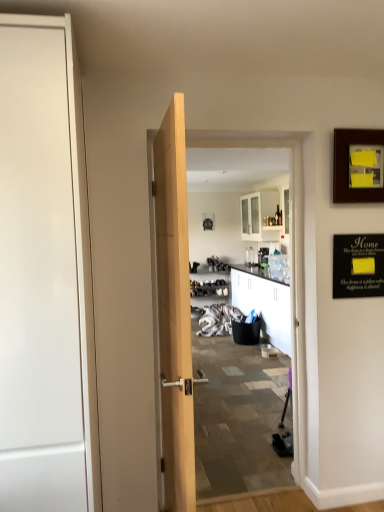
Question: From the image's perspective, would you say black matte bulletin board at upper right is shown under wooden picture frame at center, placed as the 1th picture frame when sorted from left to right?

Choices:
 (A) no
 (B) yes

Answer: (B)

Question: Is black matte bulletin board at upper right at the right side of wooden picture frame at center, acting as the 2th picture frame starting from the right?

Choices:
 (A) yes
 (B) no

Answer: (A)

Question: Can you confirm if black matte bulletin board at upper right is shorter than wooden picture frame at center, acting as the 2th picture frame starting from the right?

Choices:
 (A) yes
 (B) no

Answer: (B)

Question: Is black matte bulletin board at upper right wider than wooden picture frame at center, the 2th picture frame from the front?

Choices:
 (A) no
 (B) yes

Answer: (A)

Question: From the image's perspective, is black matte bulletin board at upper right on top of wooden picture frame at center, the 2th picture frame from the front?

Choices:
 (A) yes
 (B) no

Answer: (B)

Question: From a real-world perspective, is black matte bulletin board at upper right physically below wooden picture frame at center, placed as the 1th picture frame when sorted from left to right?

Choices:
 (A) no
 (B) yes

Answer: (B)

Question: Is wooden picture frame at upper right, placed as the 1th picture frame when sorted from right to left, closer to camera compared to wooden picture frame at center, the 2th picture frame from the front?

Choices:
 (A) no
 (B) yes

Answer: (B)

Question: Could you tell me if wooden picture frame at upper right, placed as the 1th picture frame when sorted from right to left, is facing wooden picture frame at center, acting as the 2th picture frame starting from the right?

Choices:
 (A) no
 (B) yes

Answer: (A)

Question: Is wooden picture frame at upper right, placed as the 1th picture frame when sorted from right to left, at the right side of wooden picture frame at center, placed as the 1th picture frame when sorted from left to right?

Choices:
 (A) no
 (B) yes

Answer: (B)

Question: Is wooden picture frame at upper right, the second picture frame positioned from the left, oriented away from wooden picture frame at center, acting as the 2th picture frame starting from the right?

Choices:
 (A) yes
 (B) no

Answer: (A)

Question: Is wooden picture frame at upper right, the second picture frame when ordered from back to front, at the left side of wooden picture frame at center, placed as the 1th picture frame when sorted from left to right?

Choices:
 (A) yes
 (B) no

Answer: (B)

Question: Can you confirm if wooden picture frame at upper right, placed as the 1th picture frame when sorted from right to left, is thinner than wooden picture frame at center, placed as the 1th picture frame when sorted from left to right?

Choices:
 (A) no
 (B) yes

Answer: (B)

Question: Is wooden picture frame at center, placed as the 1th picture frame when sorted from left to right, bigger than white glossy door at left?

Choices:
 (A) yes
 (B) no

Answer: (B)